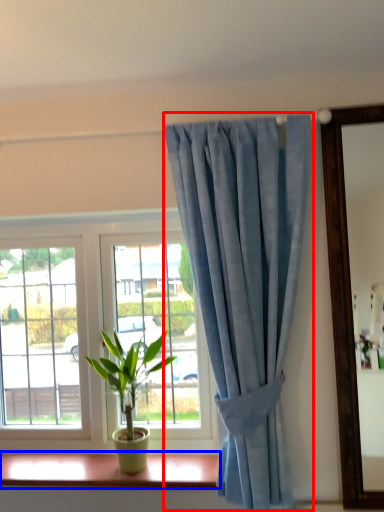
Question: Which point is closer to the camera, curtain (highlighted by a red box) or window sill (highlighted by a blue box)?

Choices:
 (A) curtain
 (B) window sill

Answer: (A)